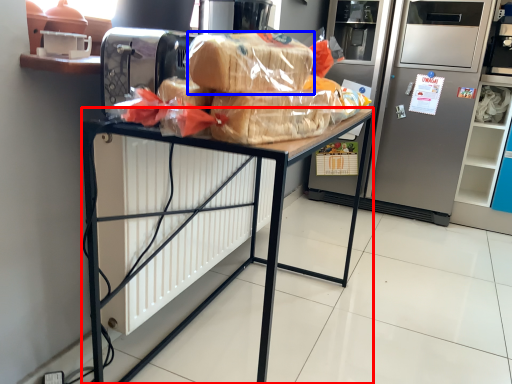
Question: Which of the following is the farthest to the observer, desk (highlighted by a red box) or bread (highlighted by a blue box)?

Choices:
 (A) desk
 (B) bread

Answer: (A)